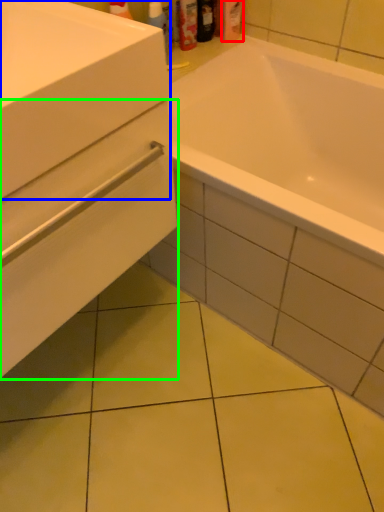
Question: Which object is the closest to the toiletry (highlighted by a red box)? Choose among these: sink (highlighted by a blue box) or drawer (highlighted by a green box).

Choices:
 (A) sink
 (B) drawer

Answer: (A)